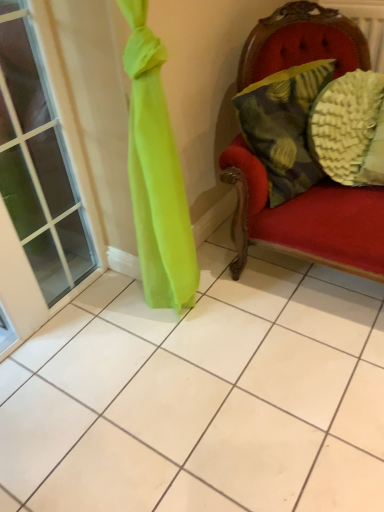
The height and width of the screenshot is (512, 384). What do you see at coordinates (38, 164) in the screenshot? I see `clear glass window at left` at bounding box center [38, 164].

Where is `textured yellow pillow at right, the 1th pillow viewed from the right`? This screenshot has width=384, height=512. textured yellow pillow at right, the 1th pillow viewed from the right is located at coordinates (350, 129).

Where is `textured yellow-green pillow at right, which ranks as the 2th pillow in right-to-left order`? This screenshot has width=384, height=512. textured yellow-green pillow at right, which ranks as the 2th pillow in right-to-left order is located at coordinates (283, 126).

Where is `clear glass window at left`? clear glass window at left is located at coordinates (38, 164).

From a real-world perspective, between textured yellow pillow at right, which ranks as the second pillow in left-to-right order, and clear glass window at left, who is vertically lower?

textured yellow pillow at right, which ranks as the second pillow in left-to-right order, is physically lower.

Can you confirm if textured yellow pillow at right, which ranks as the second pillow in left-to-right order, is positioned to the right of clear glass window at left?

Yes, textured yellow pillow at right, which ranks as the second pillow in left-to-right order, is to the right of clear glass window at left.

Is textured yellow pillow at right, the 1th pillow viewed from the right, aimed at clear glass window at left?

No, textured yellow pillow at right, the 1th pillow viewed from the right, is not aimed at clear glass window at left.

Where is `the 2nd pillow behind the clear glass window at left`? Image resolution: width=384 pixels, height=512 pixels. the 2nd pillow behind the clear glass window at left is located at coordinates (350, 129).

Is clear glass window at left touching textured yellow-green pillow at right, positioned as the 1th pillow in left-to-right order?

No, clear glass window at left is not in contact with textured yellow-green pillow at right, positioned as the 1th pillow in left-to-right order.

Considering the relative sizes of clear glass window at left and textured yellow-green pillow at right, which ranks as the 2th pillow in right-to-left order, in the image provided, is clear glass window at left thinner than textured yellow-green pillow at right, which ranks as the 2th pillow in right-to-left order,?

Correct, the width of clear glass window at left is less than that of textured yellow-green pillow at right, which ranks as the 2th pillow in right-to-left order.

From the image's perspective, does clear glass window at left appear higher than textured yellow-green pillow at right, which ranks as the 2th pillow in right-to-left order?

No, from the image's perspective, clear glass window at left is not on top of textured yellow-green pillow at right, which ranks as the 2th pillow in right-to-left order.

Is clear glass window at left aimed at textured yellow-green pillow at right, which ranks as the 2th pillow in right-to-left order?

No, clear glass window at left is not aimed at textured yellow-green pillow at right, which ranks as the 2th pillow in right-to-left order.

Can you confirm if textured yellow pillow at right, which ranks as the second pillow in left-to-right order, is taller than textured yellow-green pillow at right, which ranks as the 2th pillow in right-to-left order?

Correct, textured yellow pillow at right, which ranks as the second pillow in left-to-right order, is much taller as textured yellow-green pillow at right, which ranks as the 2th pillow in right-to-left order.

Which object is closer to the camera, textured yellow pillow at right, which ranks as the second pillow in left-to-right order, or textured yellow-green pillow at right, positioned as the 1th pillow in left-to-right order?

textured yellow-green pillow at right, positioned as the 1th pillow in left-to-right order, is closer to the camera.

Could you tell me if textured yellow pillow at right, which ranks as the second pillow in left-to-right order, is facing textured yellow-green pillow at right, which ranks as the 2th pillow in right-to-left order?

No, textured yellow pillow at right, which ranks as the second pillow in left-to-right order, does not turn towards textured yellow-green pillow at right, which ranks as the 2th pillow in right-to-left order.

From a real-world perspective, between textured yellow pillow at right, which ranks as the second pillow in left-to-right order, and textured yellow-green pillow at right, positioned as the 1th pillow in left-to-right order, who is vertically lower?

textured yellow pillow at right, which ranks as the second pillow in left-to-right order, from a real-world perspective.

Does point (278, 79) come closer to viewer compared to point (60, 158)?

Yes, it is.

From the picture: From a real-world perspective, between textured yellow-green pillow at right, positioned as the 1th pillow in left-to-right order, and clear glass window at left, who is vertically lower?

clear glass window at left is physically lower.

Is textured yellow-green pillow at right, positioned as the 1th pillow in left-to-right order, located outside clear glass window at left?

textured yellow-green pillow at right, positioned as the 1th pillow in left-to-right order, is positioned outside clear glass window at left.

Which of these two, textured yellow-green pillow at right, positioned as the 1th pillow in left-to-right order, or clear glass window at left, is thinner?

With smaller width is clear glass window at left.

Visually, is clear glass window at left positioned to the left or to the right of textured yellow pillow at right, which ranks as the second pillow in left-to-right order?

From the image, it's evident that clear glass window at left is to the left of textured yellow pillow at right, which ranks as the second pillow in left-to-right order.

Considering the sizes of clear glass window at left and textured yellow pillow at right, which ranks as the second pillow in left-to-right order, in the image, is clear glass window at left taller or shorter than textured yellow pillow at right, which ranks as the second pillow in left-to-right order,?

Considering their sizes, clear glass window at left has more height than textured yellow pillow at right, which ranks as the second pillow in left-to-right order.

Looking at this image, is textured yellow pillow at right, the 1th pillow viewed from the right, surrounded by clear glass window at left?

Definitely not — textured yellow pillow at right, the 1th pillow viewed from the right, is not inside clear glass window at left.

Is point (85, 222) less distant than point (309, 134)?

No, (85, 222) is further to viewer.

Is textured yellow-green pillow at right, positioned as the 1th pillow in left-to-right order, positioned before textured yellow pillow at right, the 1th pillow viewed from the right?

Yes, the depth of textured yellow-green pillow at right, positioned as the 1th pillow in left-to-right order, is less than that of textured yellow pillow at right, the 1th pillow viewed from the right.

Is textured yellow-green pillow at right, which ranks as the 2th pillow in right-to-left order, positioned with its back to textured yellow pillow at right, which ranks as the second pillow in left-to-right order?

That's not correct — textured yellow-green pillow at right, which ranks as the 2th pillow in right-to-left order, is not looking away from textured yellow pillow at right, which ranks as the second pillow in left-to-right order.

Considering the relative sizes of textured yellow-green pillow at right, positioned as the 1th pillow in left-to-right order, and textured yellow pillow at right, which ranks as the second pillow in left-to-right order, in the image provided, is textured yellow-green pillow at right, positioned as the 1th pillow in left-to-right order, wider than textured yellow pillow at right, which ranks as the second pillow in left-to-right order,?

No, textured yellow-green pillow at right, positioned as the 1th pillow in left-to-right order, is not wider than textured yellow pillow at right, which ranks as the second pillow in left-to-right order.

Considering the sizes of objects textured yellow-green pillow at right, which ranks as the 2th pillow in right-to-left order, and textured yellow pillow at right, the 1th pillow viewed from the right, in the image provided, who is smaller, textured yellow-green pillow at right, which ranks as the 2th pillow in right-to-left order, or textured yellow pillow at right, the 1th pillow viewed from the right,?

With smaller size is textured yellow pillow at right, the 1th pillow viewed from the right.

Locate an element on the screen. Image resolution: width=384 pixels, height=512 pixels. window lying on the left of textured yellow pillow at right, the 1th pillow viewed from the right is located at coordinates (38, 164).

Locate an element on the screen. pillow that is the 1st object located behind the clear glass window at left is located at coordinates (283, 126).

Considering their positions, is textured yellow pillow at right, the 1th pillow viewed from the right, positioned closer to clear glass window at left than textured yellow-green pillow at right, which ranks as the 2th pillow in right-to-left order?

Among the two, textured yellow-green pillow at right, which ranks as the 2th pillow in right-to-left order, is located nearer to clear glass window at left.

Considering their positions, is textured yellow pillow at right, which ranks as the second pillow in left-to-right order, positioned further to textured yellow-green pillow at right, positioned as the 1th pillow in left-to-right order, than clear glass window at left?

The object further to textured yellow-green pillow at right, positioned as the 1th pillow in left-to-right order, is clear glass window at left.

From the image, which object appears to be farther from textured yellow-green pillow at right, which ranks as the 2th pillow in right-to-left order, clear glass window at left or textured yellow pillow at right, the 1th pillow viewed from the right?

Based on the image, clear glass window at left appears to be further to textured yellow-green pillow at right, which ranks as the 2th pillow in right-to-left order.

Estimate the real-world distances between objects in this image. Which object is closer to textured yellow pillow at right, which ranks as the second pillow in left-to-right order, textured yellow-green pillow at right, which ranks as the 2th pillow in right-to-left order, or clear glass window at left?

textured yellow-green pillow at right, which ranks as the 2th pillow in right-to-left order.

Based on their spatial positions, is clear glass window at left or textured yellow-green pillow at right, which ranks as the 2th pillow in right-to-left order, further from textured yellow pillow at right, the 1th pillow viewed from the right?

The object further to textured yellow pillow at right, the 1th pillow viewed from the right, is clear glass window at left.

Estimate the real-world distances between objects in this image. Which object is further from clear glass window at left, textured yellow-green pillow at right, positioned as the 1th pillow in left-to-right order, or textured yellow pillow at right, the 1th pillow viewed from the right?

textured yellow pillow at right, the 1th pillow viewed from the right.

The image size is (384, 512). Identify the location of pillow between clear glass window at left and textured yellow pillow at right, which ranks as the second pillow in left-to-right order, from left to right. (283, 126).